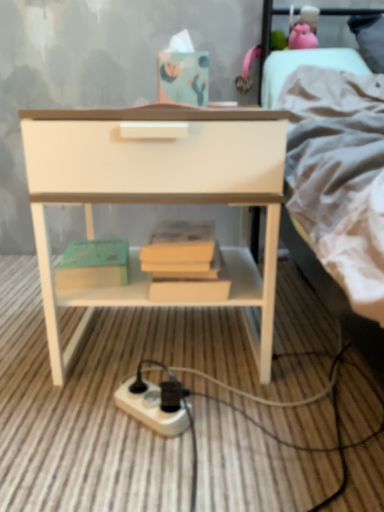
The height and width of the screenshot is (512, 384). In order to click on empty space that is ontop of green matte paperback book at lower left in this screenshot , I will do [104, 245].